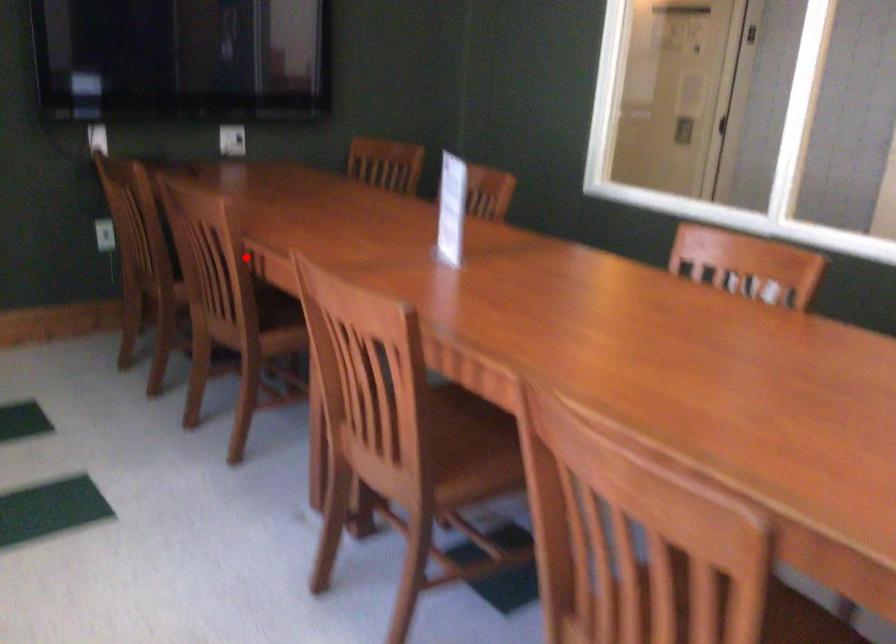
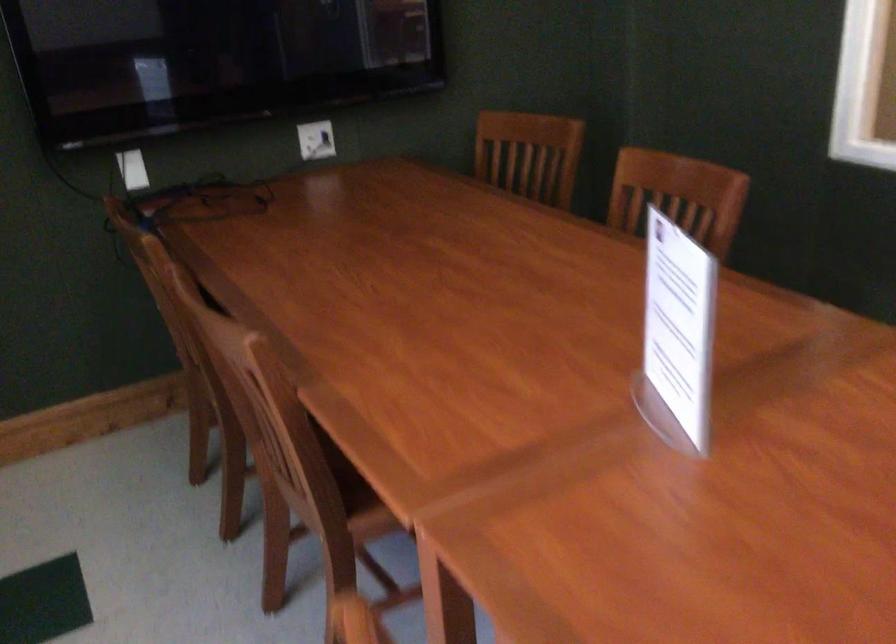
Question: I am providing you with two images of the same scene from different viewpoints. Given a red point in image1, look at the same physical point in image2. Is it:

Choices:
 (A) Closer to the viewpoint
 (B) Farther from the viewpoint

Answer: (A)